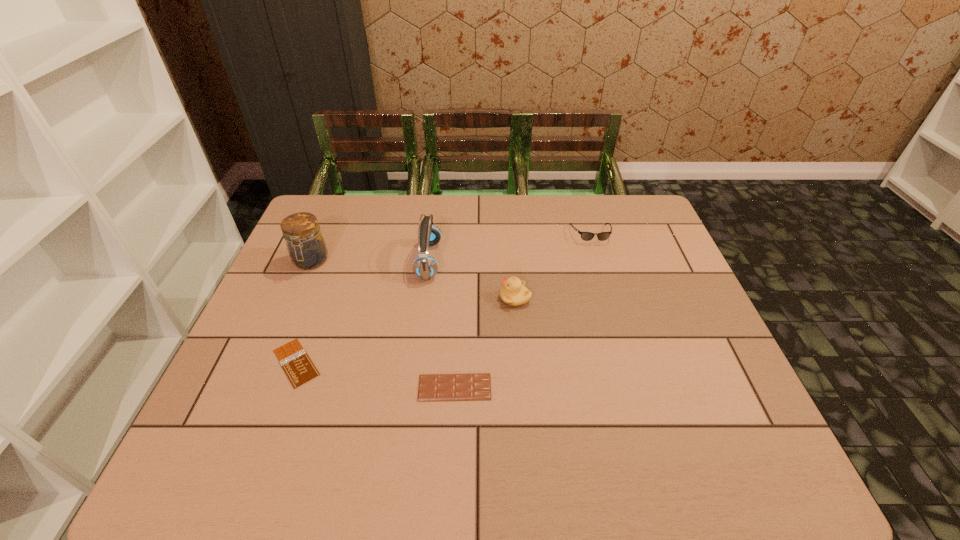
I want to click on vacant space that satisfies the following two spatial constraints: 1. on the front-facing side of the third shortest object; 2. on the beak of the duckling, so click(610, 298).

The image size is (960, 540). Find the location of `free spot that satisfies the following two spatial constraints: 1. on the lid of the shorter chocolate bar; 2. on the right side of the jar`. free spot that satisfies the following two spatial constraints: 1. on the lid of the shorter chocolate bar; 2. on the right side of the jar is located at coordinates click(268, 363).

Identify the location of vacant position in the image that satisfies the following two spatial constraints: 1. on the beak of the third nearest object; 2. on the front side of the right chocolate bar. Image resolution: width=960 pixels, height=540 pixels. (522, 387).

The width and height of the screenshot is (960, 540). What are the coordinates of `vacant space that satisfies the following two spatial constraints: 1. on the ear cups of the headset; 2. on the lid of the jar` in the screenshot? It's located at (428, 261).